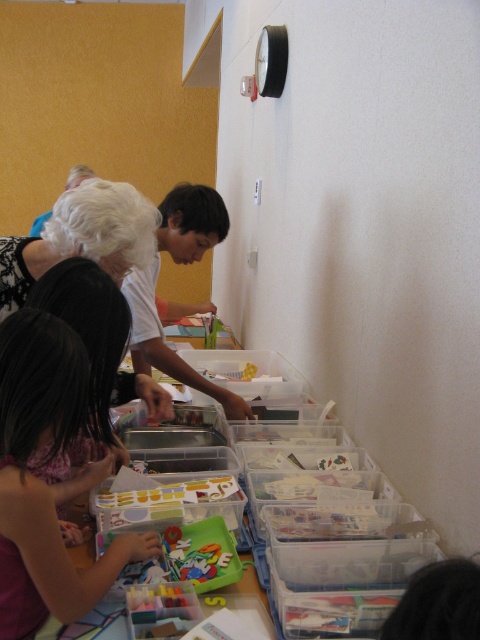
Who is more forward, [22,538] or [32,260]?

Point [22,538] is more forward.

Where is `matte pink dress at lower left`? The height and width of the screenshot is (640, 480). matte pink dress at lower left is located at coordinates (43, 481).